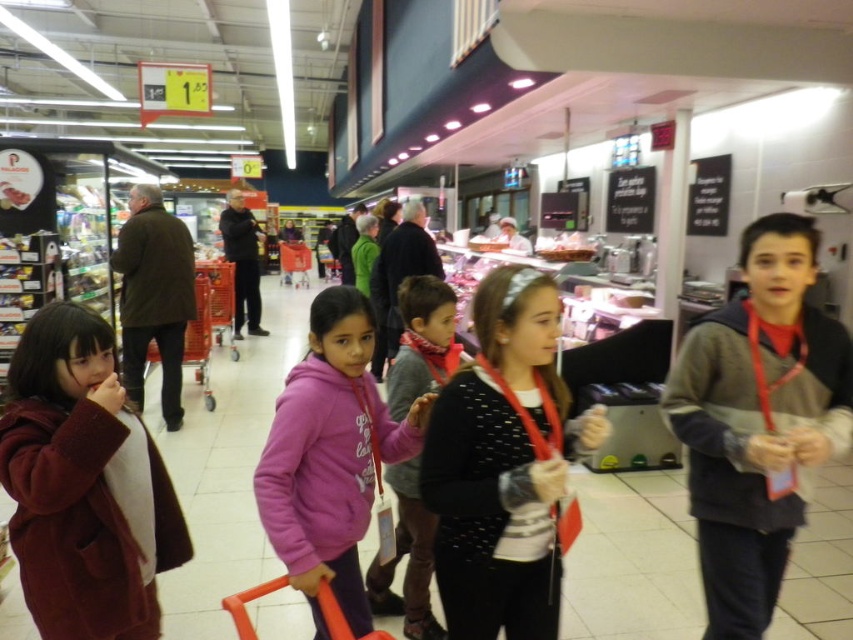
You are a tour guide leading children through the supermarket. You notice two clothing items displayed on the rack in the background. The maroon woolen coat at lower left and the pink fleece hoodie at center. Which clothing item is smaller in size?

The maroon woolen coat at lower left has a smaller size compared to the pink fleece hoodie at center, so the maroon woolen coat at lower left is smaller in size.